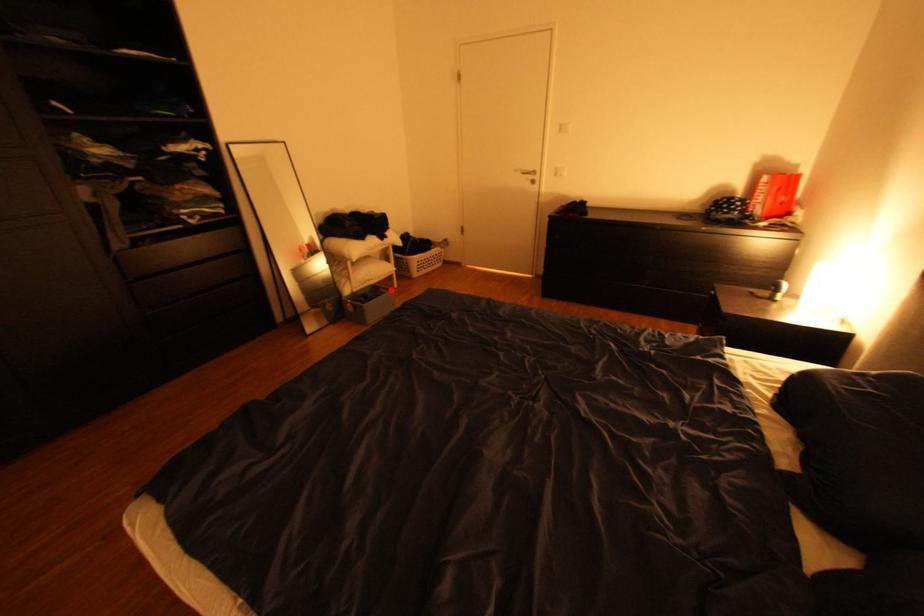
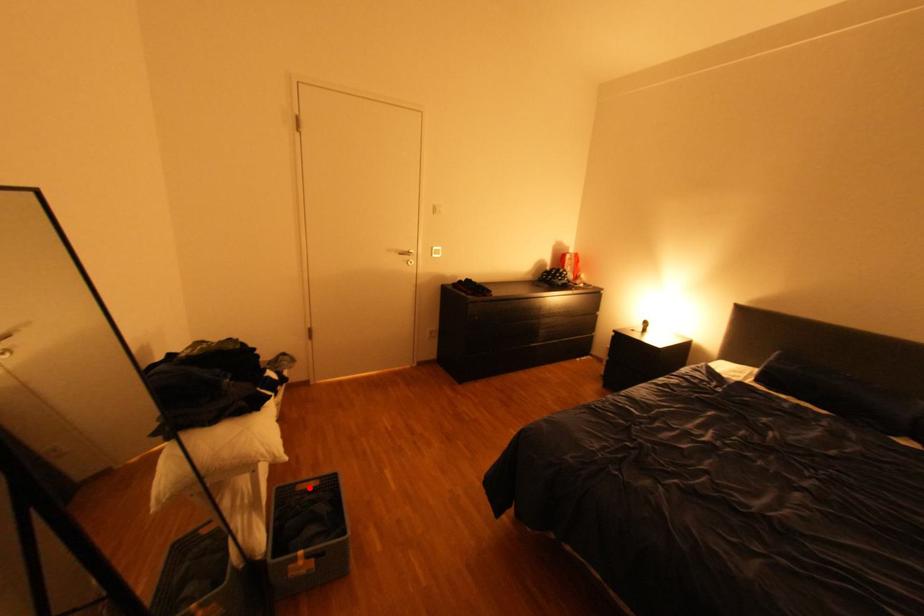
I am providing you with two images of the same scene from different viewpoints. A red point is marked on the first image and another point is marked on the second image. Is the marked point in image1 the same physical position as the marked point in image2?

Yes